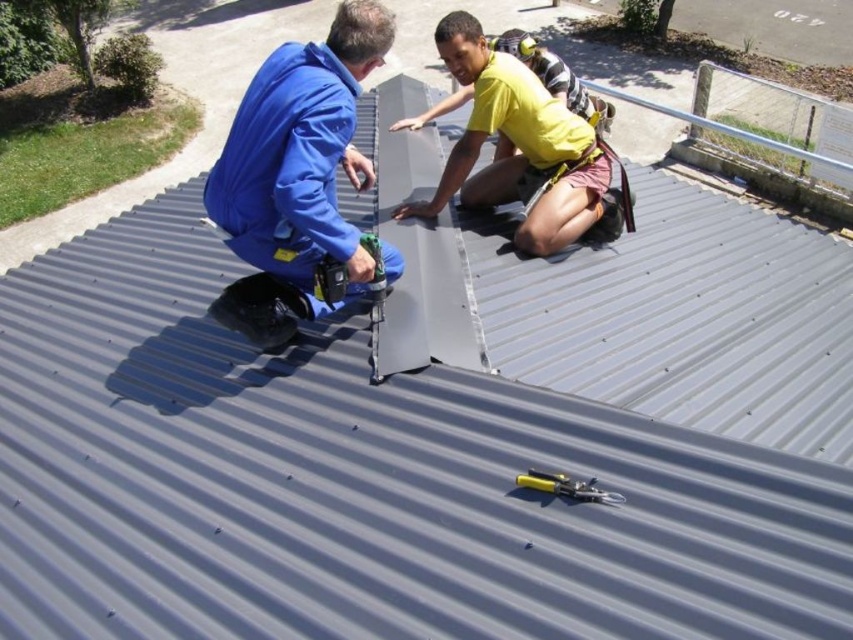
Which of these two, matte blue jumpsuit at upper left or yellow plastic pliers at center, stands shorter?

Standing shorter between the two is yellow plastic pliers at center.

This screenshot has height=640, width=853. What do you see at coordinates (294, 173) in the screenshot?
I see `matte blue jumpsuit at upper left` at bounding box center [294, 173].

Who is more forward, (376, 36) or (579, 488)?

Positioned in front is point (579, 488).

I want to click on matte blue jumpsuit at upper left, so (294, 173).

Can you confirm if matte blue jumpsuit at upper left is wider than yellow matte shirt at upper center?

No.

Based on the photo, can you confirm if matte blue jumpsuit at upper left is shorter than yellow matte shirt at upper center?

No, matte blue jumpsuit at upper left is not shorter than yellow matte shirt at upper center.

Is point (265, 109) behind point (440, 184)?

No, it is in front of (440, 184).

Where is `matte blue jumpsuit at upper left`? This screenshot has width=853, height=640. matte blue jumpsuit at upper left is located at coordinates (294, 173).

Does yellow matte shirt at upper center appear under yellow plastic pliers at center?

Incorrect, yellow matte shirt at upper center is not positioned below yellow plastic pliers at center.

Who is shorter, yellow matte shirt at upper center or yellow plastic pliers at center?

yellow plastic pliers at center

Is point (474, 81) positioned after point (549, 488)?

That is True.

Identify the location of yellow matte shirt at upper center. The height and width of the screenshot is (640, 853). (521, 148).